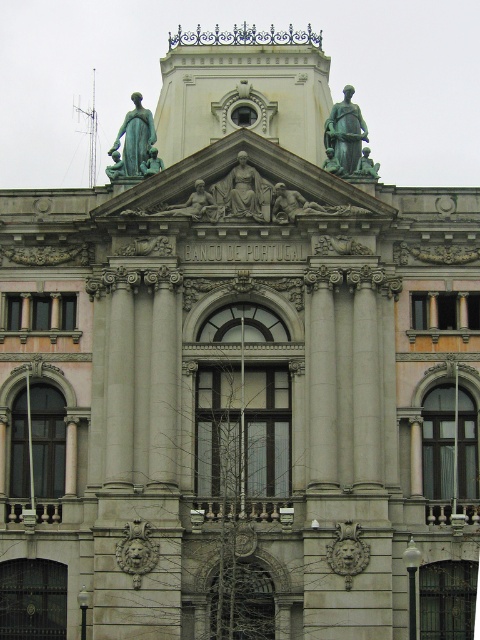
Question: Is green patina statue at upper center above matte gray stone statue at center?

Choices:
 (A) no
 (B) yes

Answer: (B)

Question: Which point is closer to the camera?

Choices:
 (A) (153, 131)
 (B) (261, 179)

Answer: (B)

Question: Is green patina statue at upper center wider than matte gray stone statue at center?

Choices:
 (A) yes
 (B) no

Answer: (B)

Question: Which of the following is the closest to the observer?

Choices:
 (A) matte gray stone statue at center
 (B) green patina statue at upper center

Answer: (A)

Question: Which of the following is the closest to the observer?

Choices:
 (A) green patina statue at upper center
 (B) matte gray stone statue at center

Answer: (B)

Question: Is green patina statue at upper center positioned at the back of matte gray stone statue at center?

Choices:
 (A) no
 (B) yes

Answer: (B)